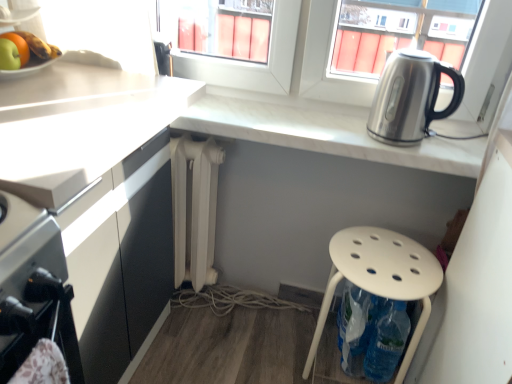
Find the location of a particular element. free space to the right of green matte apple at upper left is located at coordinates (72, 82).